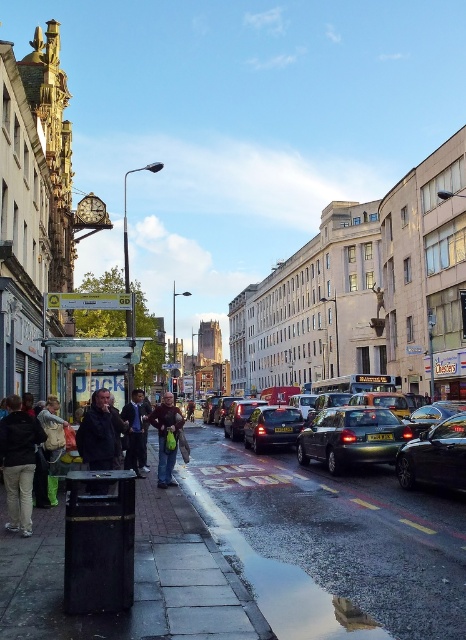
Can you confirm if shiny metallic car at center is thinner than dark gray jacket at center?

Incorrect, shiny metallic car at center's width is not less than dark gray jacket at center's.

Between point (360, 422) and point (90, 413), which one is positioned behind?

Point (360, 422)

What are the coordinates of `shiny metallic car at center` in the screenshot? It's located at (351, 436).

Which of these two, green fabric jacket at left or dark blue jacket at center, stands taller?

dark blue jacket at center

Locate an element on the screen. This screenshot has width=466, height=640. green fabric jacket at left is located at coordinates (53, 444).

Between concrete sidewalk at lower left and shiny metallic car at center, which one is positioned lower?

Positioned lower is concrete sidewalk at lower left.

Find the location of a particular element. Image resolution: width=466 pixels, height=640 pixels. concrete sidewalk at lower left is located at coordinates (331, 544).